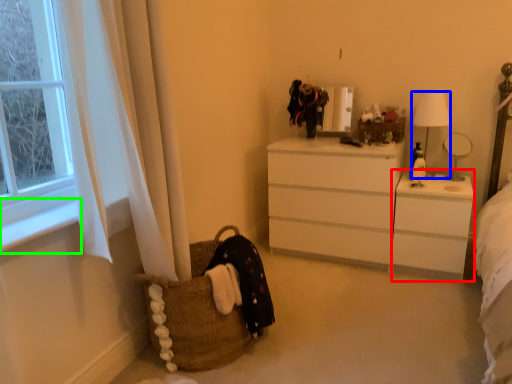
Question: Which object is positioned closest to changing table (highlighted by a red box)? Select from lamp (highlighted by a blue box) and window sill (highlighted by a green box).

Choices:
 (A) lamp
 (B) window sill

Answer: (A)